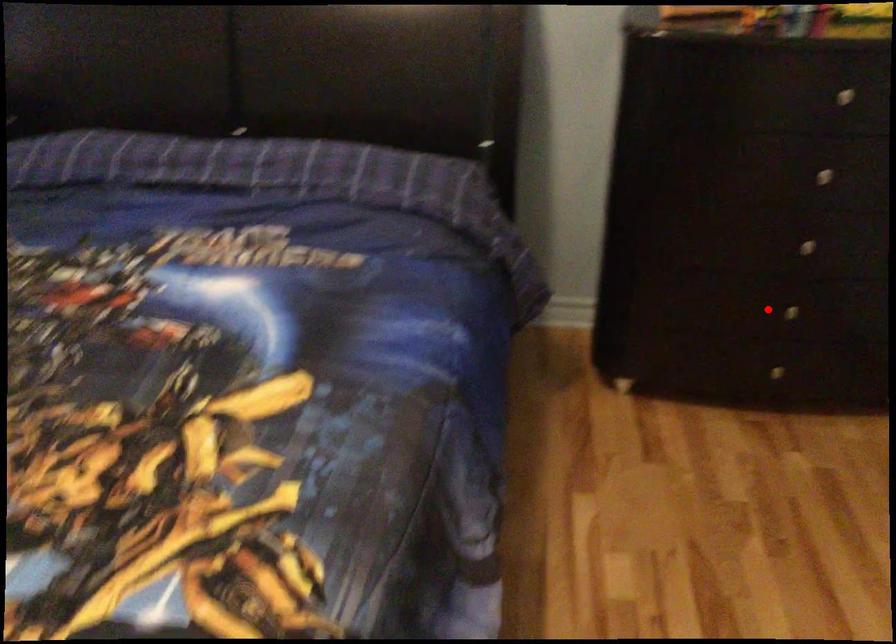
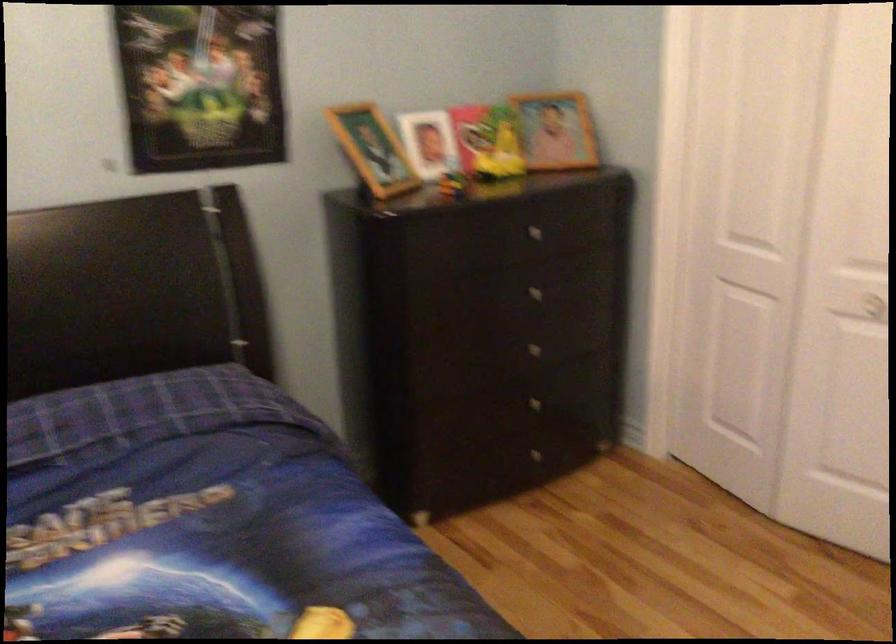
The point at the highlighted location is marked in the first image. Where is the corresponding point in the second image?

(528, 406)